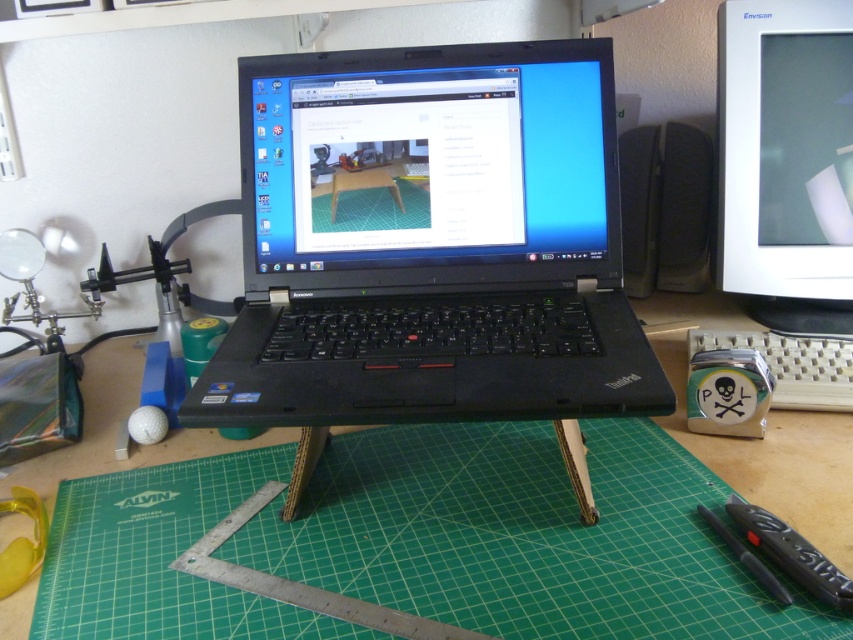
Between white glossy monitor at upper right and green cutting mat at center, which one is positioned lower?

green cutting mat at center is below.

Based on the photo, is white glossy monitor at upper right positioned before green cutting mat at center?

That is False.

Is point (785, 122) behind point (41, 470)?

Yes.

At what (x,y) coordinates should I click in order to perform the action: click on white glossy monitor at upper right. Please return your answer as a coordinate pair (x, y). Looking at the image, I should click on (786, 161).

Between black plastic laptop at center and green cutting mat at center, which one is positioned lower?

Positioned lower is green cutting mat at center.

Is black plastic laptop at center below green cutting mat at center?

No.

Is point (605, 280) more distant than point (781, 508)?

That is True.

Where is `black plastic laptop at center`? The image size is (853, 640). black plastic laptop at center is located at coordinates (428, 243).

Who is more distant from viewer, (x=583, y=412) or (x=788, y=189)?

Point (x=788, y=189)

Can you confirm if black plastic laptop at center is thinner than white glossy monitor at upper right?

Incorrect, black plastic laptop at center's width is not less than white glossy monitor at upper right's.

The width and height of the screenshot is (853, 640). I want to click on black plastic laptop at center, so click(x=428, y=243).